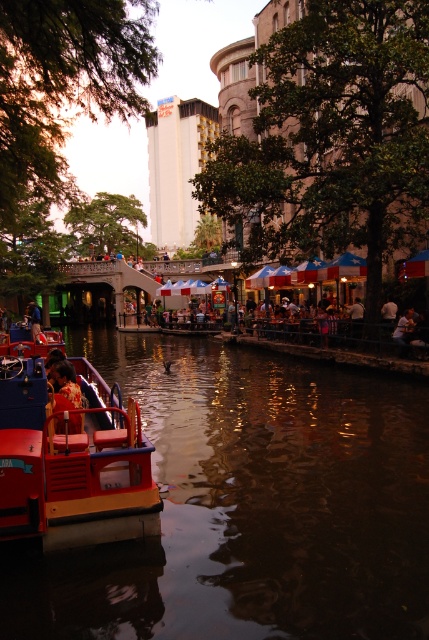
Is point (175, 522) positioned after point (30, 320)?

No, it is in front of (30, 320).

Between point (166, 531) and point (29, 316), which one is positioned in front?

Point (166, 531)

Identify the location of dark reflective water at lower center. The image size is (429, 640). (247, 506).

Can you confirm if dark reflective water at lower center is positioned above yellow fabric shirt at lower left?

Incorrect, dark reflective water at lower center is not positioned above yellow fabric shirt at lower left.

Based on the photo, can you confirm if dark reflective water at lower center is thinner than yellow fabric shirt at lower left?

Incorrect, dark reflective water at lower center's width is not less than yellow fabric shirt at lower left's.

Locate an element on the screen. dark reflective water at lower center is located at coordinates (247, 506).

Is dark reflective water at lower center to the left of red plastic boat at lower left from the viewer's perspective?

In fact, dark reflective water at lower center is to the right of red plastic boat at lower left.

Is dark reflective water at lower center positioned behind red plastic boat at lower left?

No, it is in front of red plastic boat at lower left.

Image resolution: width=429 pixels, height=640 pixels. Describe the element at coordinates (247, 506) in the screenshot. I see `dark reflective water at lower center` at that location.

At what (x,y) coordinates should I click in order to perform the action: click on dark reflective water at lower center. Please return your answer as a coordinate pair (x, y). This screenshot has width=429, height=640. Looking at the image, I should click on (247, 506).